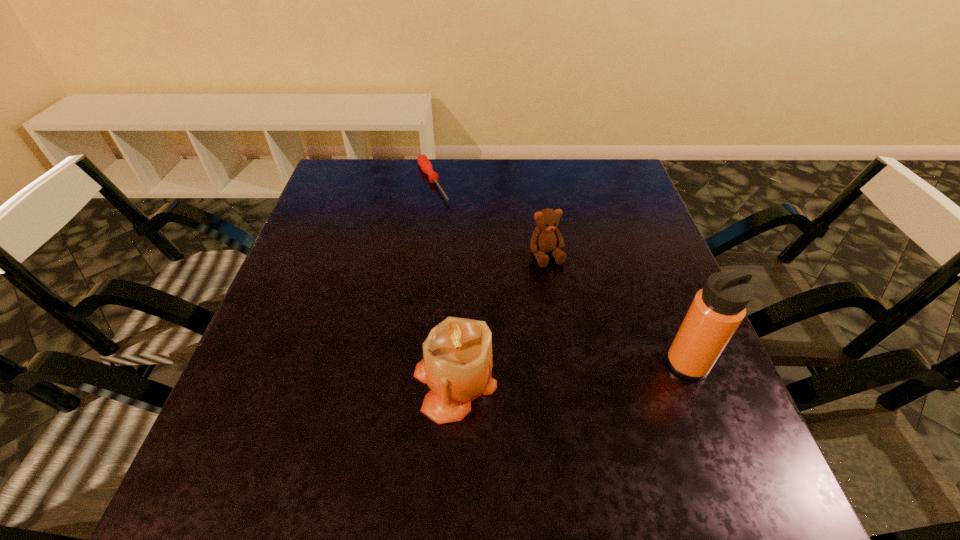
You are a GUI agent. You are given a task and a screenshot of the screen. Output one action in this format:
    pyautogui.click(x=<x>, y=<y>)
    Task: Click on the free spot on the desktop that is between the candle and the tallest object and is positioned at the tip of the shortest object
    
    Given the screenshot: What is the action you would take?
    pyautogui.click(x=555, y=374)

Where is `free space on the desktop that is between the candle and the thermos bottle and is positioned on the face of the teddy bear`? The width and height of the screenshot is (960, 540). free space on the desktop that is between the candle and the thermos bottle and is positioned on the face of the teddy bear is located at coordinates (604, 370).